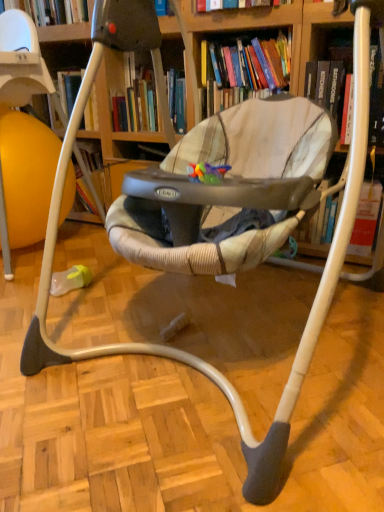
Find the location of a particular element. The width and height of the screenshot is (384, 512). free area below wooden bookcase at center (from a real-world perspective) is located at coordinates (220, 327).